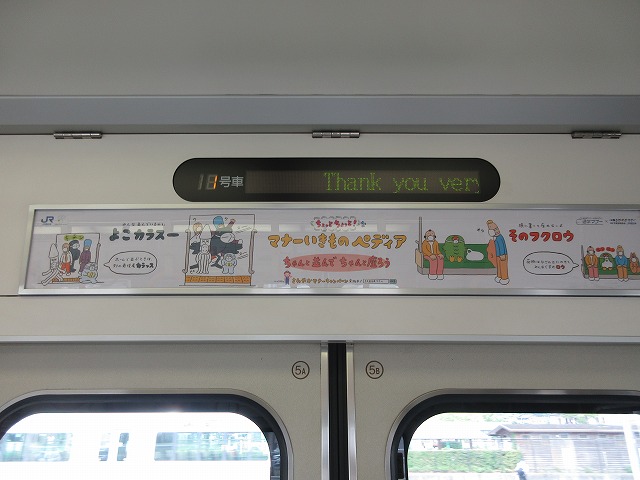
The image size is (640, 480). Identify the location of sort of shopping bag. (474, 252).